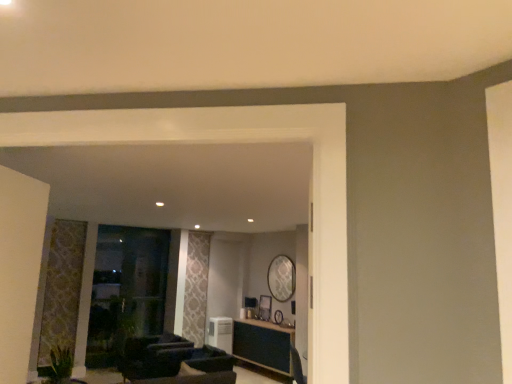
Image resolution: width=512 pixels, height=384 pixels. What do you see at coordinates (263, 345) in the screenshot?
I see `wooden table at center` at bounding box center [263, 345].

Image resolution: width=512 pixels, height=384 pixels. I want to click on transparent glass door at left, so click(126, 290).

What do you see at coordinates (221, 333) in the screenshot?
I see `white plastic air conditioner at center` at bounding box center [221, 333].

Find the location of a particular element. The image size is (512, 384). green leafy plant at lower left is located at coordinates (60, 365).

What is the approximate height of green leafy plant at lower left?

green leafy plant at lower left is 19.82 inches in height.

At what (x,y) coordinates should I click in order to perform the action: click on wooden table at center. Please return your answer as a coordinate pair (x, y). Looking at the image, I should click on (263, 345).

From a real-world perspective, is transparent glass door at left positioned above or below dark brown leather armchair at center?

In terms of real-world spatial position, transparent glass door at left is above dark brown leather armchair at center.

Which object is positioned more to the left, transparent glass door at left or dark brown leather armchair at center?

Positioned to the left is transparent glass door at left.

Is transparent glass door at left directly adjacent to dark brown leather armchair at center?

No, transparent glass door at left is not beside dark brown leather armchair at center.

Which point is more distant from viewer, (118, 270) or (143, 339)?

The point (143, 339) is farther from the camera.

From a real-world perspective, is wooden table at center above or below transparent glass door at left?

wooden table at center is below transparent glass door at left.

Considering the sizes of objects wooden table at center and transparent glass door at left in the image provided, who is shorter, wooden table at center or transparent glass door at left?

wooden table at center is shorter.

Is wooden table at center positioned before transparent glass door at left?

Yes.

Which point is more distant from viewer, (230, 319) or (297, 363)?

The point (230, 319) is more distant.

From a real-world perspective, is white plastic air conditioner at center located higher than metallic silver swivel chair at center?

No, from a real-world perspective, white plastic air conditioner at center is not above metallic silver swivel chair at center.

Can you confirm if white plastic air conditioner at center is positioned to the right of metallic silver swivel chair at center?

No, white plastic air conditioner at center is not to the right of metallic silver swivel chair at center.

From the image's perspective, between white plastic air conditioner at center and metallic silver swivel chair at center, who is located below?

white plastic air conditioner at center is shown below in the image.

Choose the correct answer: Is dark brown leather armchair at center inside white plastic air conditioner at center or outside it?

The correct answer is: outside.

Is dark brown leather armchair at center smaller than white plastic air conditioner at center?

Incorrect, dark brown leather armchair at center is not smaller in size than white plastic air conditioner at center.

You are a GUI agent. You are given a task and a screenshot of the screen. Output one action in this format:
    pyautogui.click(x=<x>, y=<y>)
    Task: Click on the armchair above the white plastic air conditioner at center (from the image's perspective)
    
    Given the screenshot: What is the action you would take?
    pyautogui.click(x=174, y=361)

Can you tell me how much dark brown leather armchair at center and white plastic air conditioner at center differ in facing direction?

164 degrees.

In the image, there is a dark brown leather armchair at center. Identify the location of swivel chair below it (from the image's perspective). (297, 366).

Which object is further away from the camera, dark brown leather armchair at center or metallic silver swivel chair at center?

metallic silver swivel chair at center is further away from the camera.

From the image's perspective, is dark brown leather armchair at center located beneath metallic silver swivel chair at center?

No, from the image's perspective, dark brown leather armchair at center is not below metallic silver swivel chair at center.

Does point (213, 348) appear closer or farther from the camera than point (294, 348)?

Point (213, 348) is closer to the camera than point (294, 348).

From a real-world perspective, between green leafy plant at lower left and wooden picture frame at center, who is vertically higher?

From a 3D spatial view, wooden picture frame at center is above.

Is green leafy plant at lower left outside of wooden picture frame at center?

Indeed, green leafy plant at lower left is completely outside wooden picture frame at center.

Between green leafy plant at lower left and wooden picture frame at center, which one has more height?

Standing taller between the two is green leafy plant at lower left.

Does green leafy plant at lower left have a lesser width compared to wooden picture frame at center?

Incorrect, the width of green leafy plant at lower left is not less than that of wooden picture frame at center.

You are a GUI agent. You are given a task and a screenshot of the screen. Output one action in this format:
    pyautogui.click(x=<x>, y=<y>)
    Task: Click on the picture frame lying below the metallic silver swivel chair at center (from the image's perspective)
    
    Given the screenshot: What is the action you would take?
    pyautogui.click(x=264, y=307)

Is wooden picture frame at center a part of metallic silver swivel chair at center?

No.

From a real-world perspective, who is located lower, metallic silver swivel chair at center or wooden picture frame at center?

From a 3D spatial view, metallic silver swivel chair at center is below.

Is there a large distance between metallic silver swivel chair at center and wooden picture frame at center?

No.

Locate an element on the screen. The image size is (512, 384). armchair in front of the transparent glass door at left is located at coordinates (174, 361).

You are a GUI agent. You are given a task and a screenshot of the screen. Output one action in this format:
    pyautogui.click(x=<x>, y=<y>)
    Task: Click on the glass door behind the wooden table at center
    The width and height of the screenshot is (512, 384).
    Given the screenshot: What is the action you would take?
    pyautogui.click(x=126, y=290)

Based on their spatial positions, is transparent glass door at left or white plastic air conditioner at center further from wooden picture frame at center?

transparent glass door at left is further to wooden picture frame at center.

Considering their positions, is transparent glass door at left positioned further to wooden table at center than green leafy plant at lower left?

green leafy plant at lower left is further to wooden table at center.

Looking at the image, which one is located closer to metallic silver swivel chair at center, green leafy plant at lower left or transparent glass door at left?

transparent glass door at left is closer to metallic silver swivel chair at center.

Which object lies nearer to the anchor point white plastic air conditioner at center, dark brown leather armchair at center or metallic silver swivel chair at center?

Among the two, dark brown leather armchair at center is located nearer to white plastic air conditioner at center.

In the scene shown: Which object lies nearer to the anchor point wooden table at center, white plastic air conditioner at center or metallic silver swivel chair at center?

metallic silver swivel chair at center is positioned closer to the anchor wooden table at center.

Consider the image. Considering their positions, is white plastic air conditioner at center positioned closer to wooden picture frame at center than dark brown leather armchair at center?

white plastic air conditioner at center.

Considering their positions, is dark brown leather armchair at center positioned further to metallic silver swivel chair at center than wooden picture frame at center?

dark brown leather armchair at center.

Estimate the real-world distances between objects in this image. Which object is further from transparent glass door at left, green leafy plant at lower left or wooden picture frame at center?

wooden picture frame at center is further to transparent glass door at left.

Where is `plant between dark brown leather armchair at center and white plastic air conditioner at center along the z-axis`? The image size is (512, 384). plant between dark brown leather armchair at center and white plastic air conditioner at center along the z-axis is located at coordinates (60, 365).

Find the location of a particular element. The width and height of the screenshot is (512, 384). plant located between transparent glass door at left and metallic silver swivel chair at center in the left-right direction is located at coordinates (60, 365).

Find the location of a particular element. This screenshot has width=512, height=384. table between green leafy plant at lower left and wooden picture frame at center from front to back is located at coordinates (263, 345).

Image resolution: width=512 pixels, height=384 pixels. I want to click on picture frame situated between transparent glass door at left and wooden table at center from left to right, so click(x=264, y=307).